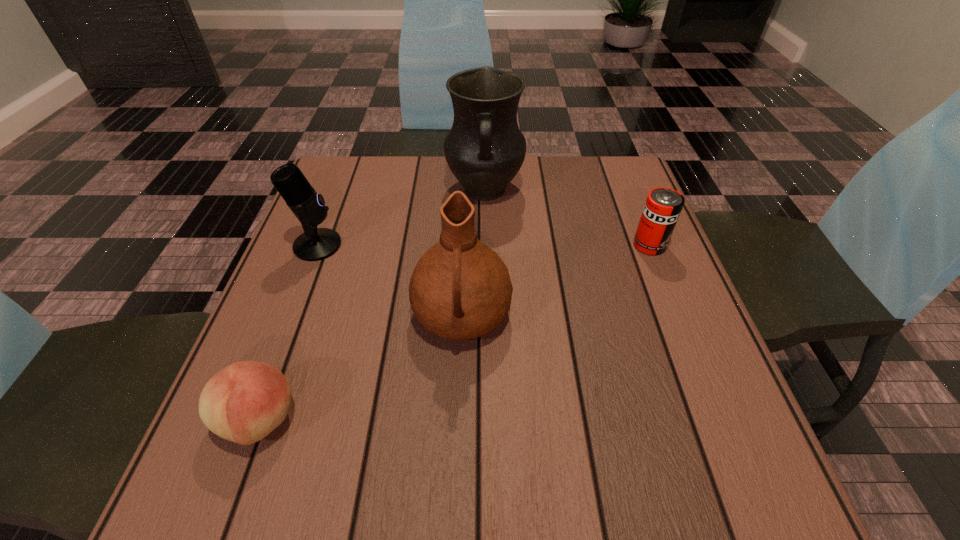
I want to click on free space between the microphone and the shortest object, so click(288, 333).

Locate an element on the screen. free spot between the farther pitcher and the third tallest object is located at coordinates (401, 218).

Find the location of `empty location between the third shortest object and the nearest object`. empty location between the third shortest object and the nearest object is located at coordinates pyautogui.click(x=288, y=333).

Identify which object is located as the third nearest to the shortest object. Please provide its 2D coordinates. Your answer should be formatted as a tuple, i.e. [(x, y)], where the tuple contains the x and y coordinates of a point satisfying the conditions above.

[(484, 149)]

Find the location of a particular element. This screenshot has height=540, width=960. the third closest object relative to the second nearest object is located at coordinates (484, 149).

The image size is (960, 540). In order to click on free point that satisfies the following two spatial constraints: 1. on the stand of the rightmost object; 2. on the left side of the microphone in this screenshot , I will do `click(318, 245)`.

Image resolution: width=960 pixels, height=540 pixels. Find the location of `vacant position in the image that satisfies the following two spatial constraints: 1. on the back side of the shortest object; 2. on the stand of the microphone`. vacant position in the image that satisfies the following two spatial constraints: 1. on the back side of the shortest object; 2. on the stand of the microphone is located at coordinates (324, 245).

Find the location of a particular element. free space in the image that satisfies the following two spatial constraints: 1. on the stand of the third tallest object; 2. on the left side of the rightmost object is located at coordinates (318, 245).

I want to click on free space that satisfies the following two spatial constraints: 1. on the stand of the peach; 2. on the right side of the microphone, so click(x=251, y=420).